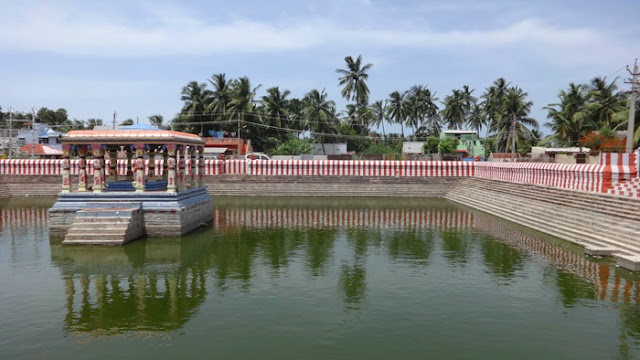
Locate an element on the screen. The height and width of the screenshot is (360, 640). cover is located at coordinates (144, 133).